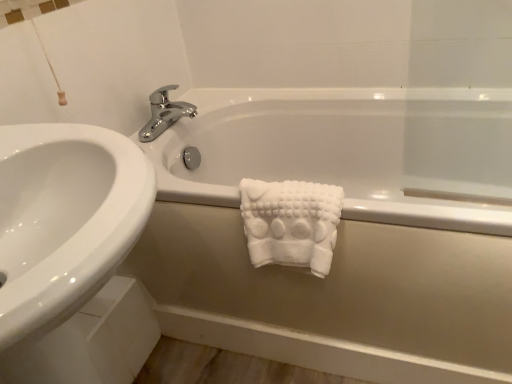
Question: Considering the relative sizes of white fluffy towel at center and white matte bathtub at center in the image provided, is white fluffy towel at center bigger than white matte bathtub at center?

Choices:
 (A) no
 (B) yes

Answer: (A)

Question: Can you confirm if white fluffy towel at center is thinner than white matte bathtub at center?

Choices:
 (A) no
 (B) yes

Answer: (B)

Question: Considering the relative positions of white fluffy towel at center and white matte bathtub at center in the image provided, is white fluffy towel at center to the right of white matte bathtub at center from the viewer's perspective?

Choices:
 (A) yes
 (B) no

Answer: (B)

Question: From the image's perspective, does white fluffy towel at center appear higher than white matte bathtub at center?

Choices:
 (A) yes
 (B) no

Answer: (B)

Question: From a real-world perspective, is white fluffy towel at center positioned under white matte bathtub at center based on gravity?

Choices:
 (A) no
 (B) yes

Answer: (A)

Question: From the image's perspective, is chrome/metallic faucet at upper center positioned above or below white fluffy towel at center?

Choices:
 (A) above
 (B) below

Answer: (A)

Question: Based on their sizes in the image, would you say chrome/metallic faucet at upper center is bigger or smaller than white fluffy towel at center?

Choices:
 (A) small
 (B) big

Answer: (A)

Question: Do you think chrome/metallic faucet at upper center is within white fluffy towel at center, or outside of it?

Choices:
 (A) outside
 (B) inside

Answer: (A)

Question: Considering their positions, is chrome/metallic faucet at upper center located in front of or behind white fluffy towel at center?

Choices:
 (A) front
 (B) behind

Answer: (B)

Question: Looking at the image, does white fluffy towel at center seem bigger or smaller compared to chrome/metallic faucet at upper center?

Choices:
 (A) big
 (B) small

Answer: (A)

Question: Considering their positions, is white fluffy towel at center located in front of or behind chrome/metallic faucet at upper center?

Choices:
 (A) front
 (B) behind

Answer: (A)

Question: Would you say white fluffy towel at center is inside or outside chrome/metallic faucet at upper center?

Choices:
 (A) outside
 (B) inside

Answer: (A)

Question: Does point (280, 240) appear closer or farther from the camera than point (168, 122)?

Choices:
 (A) farther
 (B) closer

Answer: (B)

Question: Does point (96, 246) appear closer or farther from the camera than point (351, 163)?

Choices:
 (A) farther
 (B) closer

Answer: (B)

Question: From their relative heights in the image, would you say white glossy sink at upper left is taller or shorter than white matte bathtub at center?

Choices:
 (A) tall
 (B) short

Answer: (A)